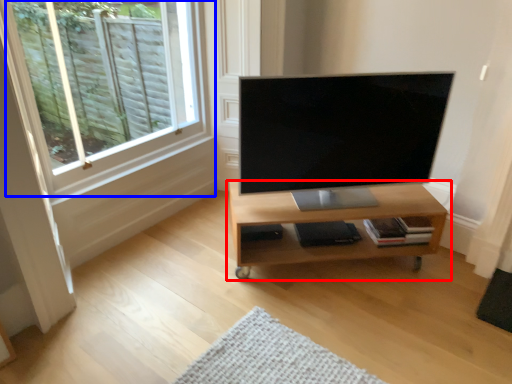
Question: Which object is further to the camera taking this photo, shelf (highlighted by a red box) or window (highlighted by a blue box)?

Choices:
 (A) shelf
 (B) window

Answer: (A)